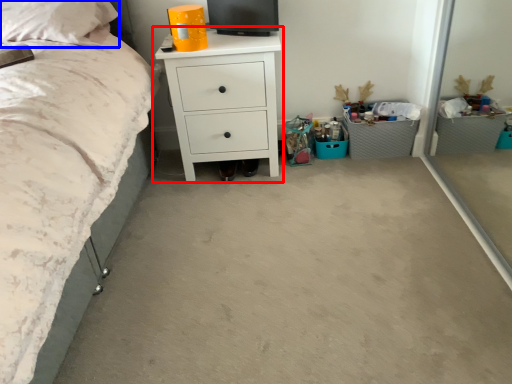
Question: Which object appears closest to the camera in this image, chest of drawers (highlighted by a red box) or pillow (highlighted by a blue box)?

Choices:
 (A) chest of drawers
 (B) pillow

Answer: (B)